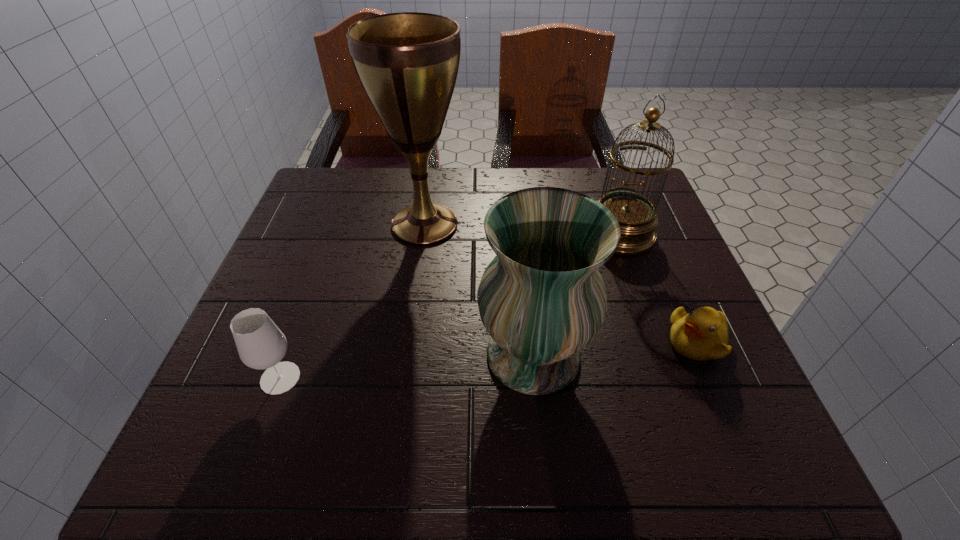
You are a GUI agent. You are given a task and a screenshot of the screen. Output one action in this format:
    pyautogui.click(x=<x>, y=<y>)
    Task: Click on the empty space that is in between the birdcage and the glass
    
    Given the screenshot: What is the action you would take?
    pyautogui.click(x=450, y=306)

I want to click on empty space between the vase and the duckling, so click(x=614, y=348).

The image size is (960, 540). In order to click on blank region between the leftmost object and the vase in this screenshot , I will do `click(407, 367)`.

The height and width of the screenshot is (540, 960). I want to click on vacant area that lies between the glass and the tallest object, so click(x=352, y=301).

Identify the location of object that stands as the second closest to the birdcage. (701, 335).

Locate which object is the closest to the birdcage. Please provide its 2D coordinates. Your answer should be formatted as a tuple, i.e. [(x, y)], where the tuple contains the x and y coordinates of a point satisfying the conditions above.

[(542, 299)]

Identify the location of vacant space that satisfies the following two spatial constraints: 1. on the back side of the third object from left to right; 2. on the right side of the fourth tallest object. (289, 355).